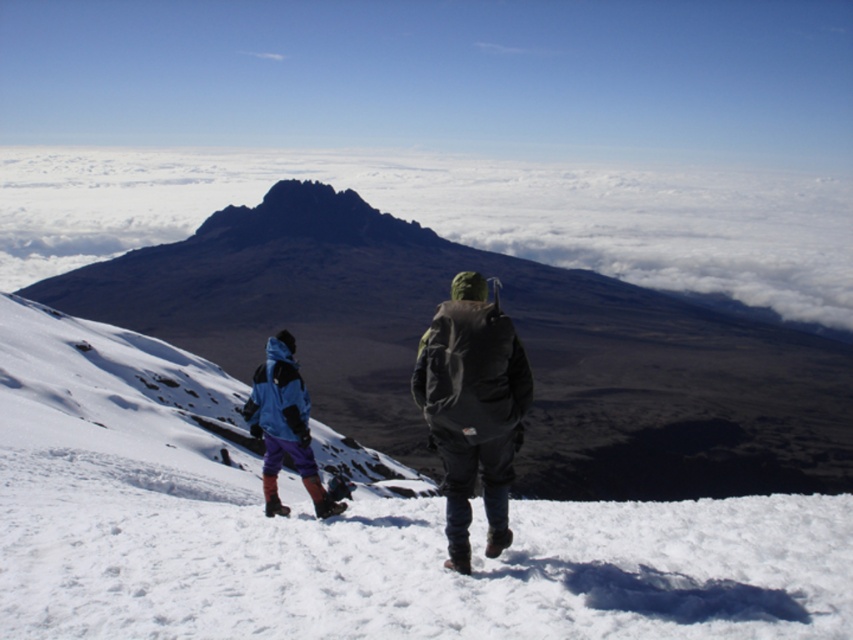
Question: Considering the relative positions of white powdery snow at center and dark green waterproof jacket at center in the image provided, where is white powdery snow at center located with respect to dark green waterproof jacket at center?

Choices:
 (A) below
 (B) above

Answer: (A)

Question: Where is dark brown rocky mountain at center located in relation to blue fleece jacket at lower left in the image?

Choices:
 (A) left
 (B) right

Answer: (B)

Question: Estimate the real-world distances between objects in this image. Which object is farther from the dark green waterproof jacket at center?

Choices:
 (A) dark brown rocky mountain at center
 (B) white powdery snow at center

Answer: (A)

Question: Among these points, which one is farthest from the camera?

Choices:
 (A) (236, 346)
 (B) (300, 448)
 (C) (326, 228)
 (D) (115, 369)

Answer: (C)

Question: Among these points, which one is nearest to the camera?

Choices:
 (A) (531, 483)
 (B) (346, 211)
 (C) (529, 172)
 (D) (241, 458)

Answer: (D)

Question: In this image, where is dark brown rocky mountain at center located relative to white fluffy cloud at upper center?

Choices:
 (A) above
 (B) below

Answer: (B)